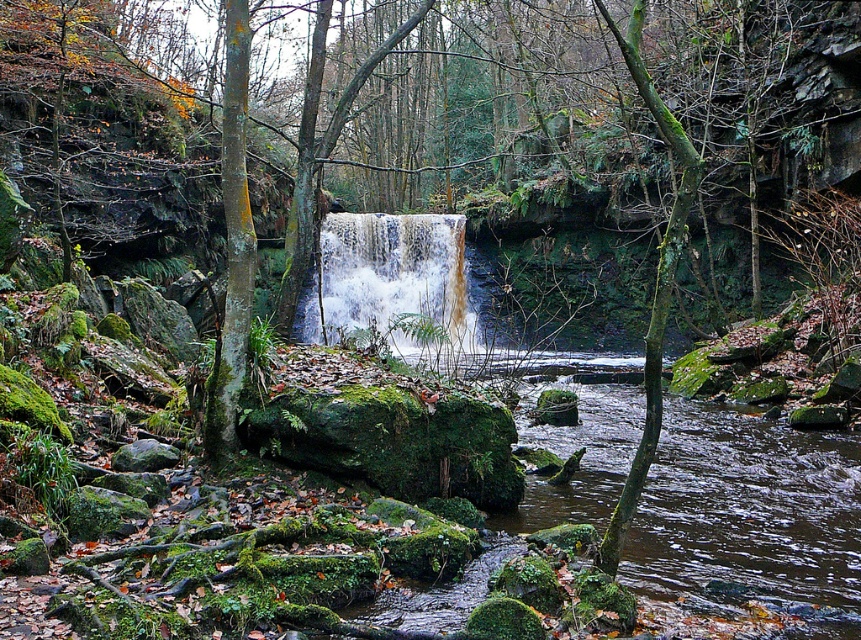
You are standing at the base of the waterfall in the serene natural scene. You see two points marked on the ground. One is at point (x=812, y=520) and the other at point (x=426, y=292). If you want to move towards the waterfall, which point should you step on first?

Point (x=812, y=520) is in front of point (x=426, y=292), so you should step on point (x=812, y=520) first to move towards the waterfall.